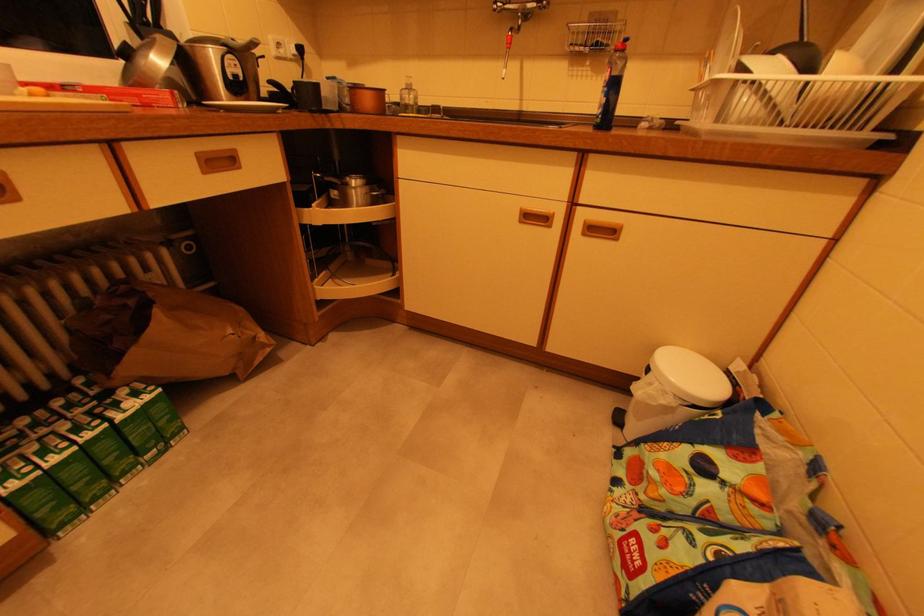
The height and width of the screenshot is (616, 924). What do you see at coordinates (210, 161) in the screenshot?
I see `the drawer handle` at bounding box center [210, 161].